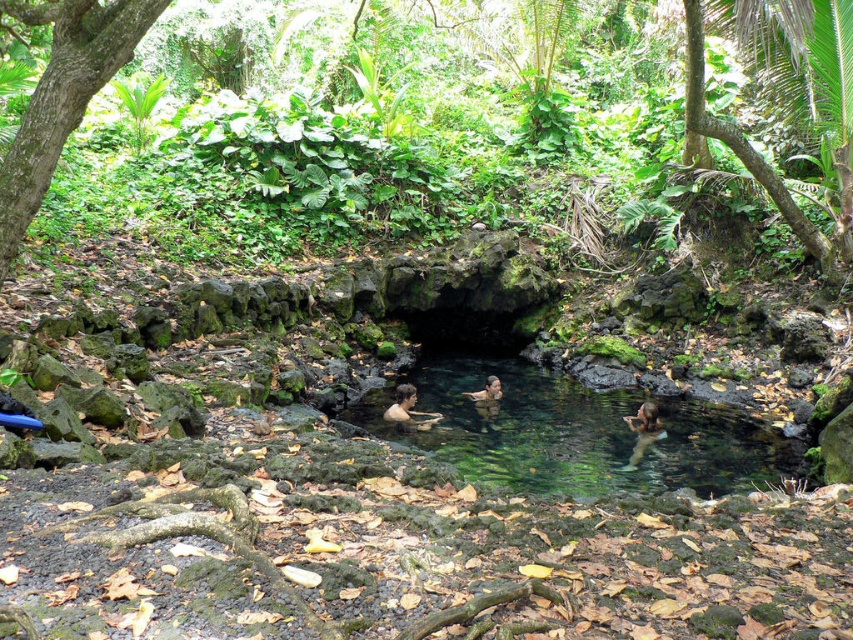
You are standing at the edge of the pool and want to reach the clear water at center without stepping on the green leafy vegetation at center. Which direction should you move?

Since the green leafy vegetation at center is to the left of clear water at center, you should move to the right to avoid stepping on the vegetation and reach the clear water at center.

Consider the image. You are a photographer standing at the edge of the pool. You want to take a photo that includes both the nude skin at lower right and the smooth skin woman at center. Based on their distance, will they both fit in the frame if your camera has a standard 50mm lens? Assume the camera is held at eye level and the frame can capture a horizontal span of about 6 feet at this distance.

The nude skin at lower right and smooth skin woman at center are 5.97 feet apart. Since the camera frame can capture up to 6 feet horizontally, they will both fit in the frame as their distance is just under the maximum span.

You are a photographer standing at the edge of the natural pool and want to capture both the nude skin at lower right and the smooth skin woman at center in your shot. Which subject is positioned closer to you?

The nude skin at lower right is closer to the viewer than the smooth skin woman at center, so the nude skin at lower right is the subject positioned closer to you.